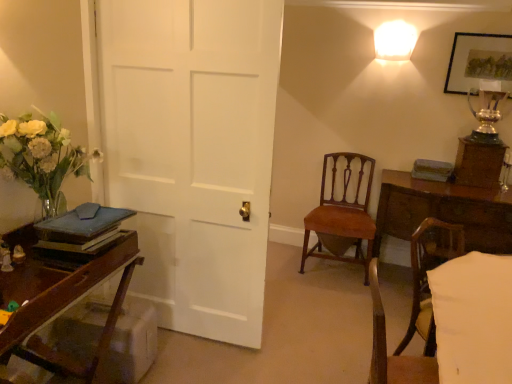
Question: Is wooden desk at left not inside light brown wood chair at lower right, which ranks as the 1th chair in front-to-back order?

Choices:
 (A) yes
 (B) no

Answer: (A)

Question: Is wooden desk at left at the left side of light brown wood chair at lower right, which is the second chair in back-to-front order?

Choices:
 (A) yes
 (B) no

Answer: (A)

Question: From the image's perspective, does wooden desk at left appear higher than light brown wood chair at lower right, which ranks as the 1th chair in front-to-back order?

Choices:
 (A) no
 (B) yes

Answer: (A)

Question: From the image's perspective, is wooden desk at left under light brown wood chair at lower right, which ranks as the 1th chair in front-to-back order?

Choices:
 (A) yes
 (B) no

Answer: (A)

Question: Is wooden desk at left positioned far away from light brown wood chair at lower right, which is the second chair in back-to-front order?

Choices:
 (A) no
 (B) yes

Answer: (B)

Question: Can you confirm if wooden desk at left is wider than light brown wood chair at lower right, which ranks as the 1th chair in front-to-back order?

Choices:
 (A) no
 (B) yes

Answer: (B)

Question: Would you say white frosted glass sconce at upper right is a long distance from mahogany wood chair at center, the 1th chair viewed from the back?

Choices:
 (A) no
 (B) yes

Answer: (B)

Question: From the image's perspective, is white frosted glass sconce at upper right above mahogany wood chair at center, placed as the second chair when sorted from front to back?

Choices:
 (A) no
 (B) yes

Answer: (B)

Question: Is white frosted glass sconce at upper right taller than mahogany wood chair at center, the 1th chair viewed from the back?

Choices:
 (A) yes
 (B) no

Answer: (B)

Question: From a real-world perspective, is white frosted glass sconce at upper right over mahogany wood chair at center, placed as the second chair when sorted from front to back?

Choices:
 (A) yes
 (B) no

Answer: (A)

Question: From a real-world perspective, is white frosted glass sconce at upper right under mahogany wood chair at center, placed as the second chair when sorted from front to back?

Choices:
 (A) yes
 (B) no

Answer: (B)

Question: Can you confirm if white frosted glass sconce at upper right is positioned to the right of mahogany wood chair at center, placed as the second chair when sorted from front to back?

Choices:
 (A) yes
 (B) no

Answer: (A)

Question: From a real-world perspective, is silver metallic trophy at upper right positioned over light brown wood chair at lower right, which ranks as the 1th chair in front-to-back order, based on gravity?

Choices:
 (A) no
 (B) yes

Answer: (B)